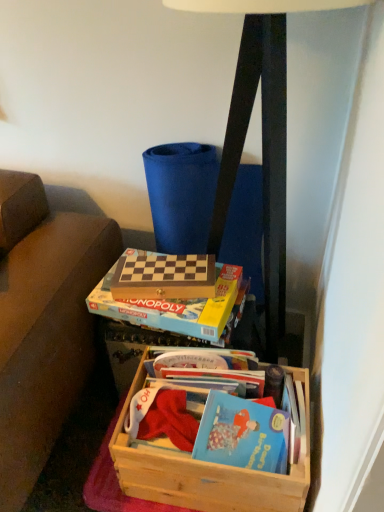
Question: Could you tell me if hardcover book at center, which is counted as the 1th paperback book, starting from the front, is facing wooden board game at center, the 1th paperback book in the back-to-front sequence?

Choices:
 (A) yes
 (B) no

Answer: (B)

Question: Considering the relative sizes of hardcover book at center, which is counted as the 1th paperback book, starting from the front, and wooden board game at center, arranged as the second paperback book when viewed from the front, in the image provided, is hardcover book at center, which is counted as the 1th paperback book, starting from the front, shorter than wooden board game at center, arranged as the second paperback book when viewed from the front,?

Choices:
 (A) no
 (B) yes

Answer: (A)

Question: Is hardcover book at center, which is the 2th paperback book from back to front, positioned in front of wooden board game at center, arranged as the second paperback book when viewed from the front?

Choices:
 (A) no
 (B) yes

Answer: (B)

Question: Is there a large distance between hardcover book at center, which is the 2th paperback book from back to front, and wooden board game at center, arranged as the second paperback book when viewed from the front?

Choices:
 (A) yes
 (B) no

Answer: (B)

Question: Considering the relative sizes of hardcover book at center, which is counted as the 1th paperback book, starting from the front, and wooden board game at center, the 1th paperback book in the back-to-front sequence, in the image provided, is hardcover book at center, which is counted as the 1th paperback book, starting from the front, smaller than wooden board game at center, the 1th paperback book in the back-to-front sequence,?

Choices:
 (A) no
 (B) yes

Answer: (A)

Question: From the image's perspective, does hardcover book at center, which is counted as the 1th paperback book, starting from the front, appear lower than wooden board game at center, arranged as the second paperback book when viewed from the front?

Choices:
 (A) yes
 (B) no

Answer: (A)

Question: Would you consider matte black lamp at upper center to be distant from wooden board game at center, arranged as the second paperback book when viewed from the front?

Choices:
 (A) no
 (B) yes

Answer: (A)

Question: From a real-world perspective, is matte black lamp at upper center positioned over wooden board game at center, the 1th paperback book in the back-to-front sequence, based on gravity?

Choices:
 (A) yes
 (B) no

Answer: (A)

Question: Does matte black lamp at upper center have a smaller size compared to wooden board game at center, the 1th paperback book in the back-to-front sequence?

Choices:
 (A) yes
 (B) no

Answer: (B)

Question: Can you confirm if matte black lamp at upper center is shorter than wooden board game at center, arranged as the second paperback book when viewed from the front?

Choices:
 (A) yes
 (B) no

Answer: (B)

Question: Is the position of matte black lamp at upper center more distant than that of wooden board game at center, the 1th paperback book in the back-to-front sequence?

Choices:
 (A) no
 (B) yes

Answer: (A)

Question: Is matte black lamp at upper center completely or partially outside of wooden board game at center, arranged as the second paperback book when viewed from the front?

Choices:
 (A) no
 (B) yes

Answer: (B)

Question: Is hardcover book at center, which is the 2th paperback book from back to front, at the right side of wooden crate at lower center?

Choices:
 (A) no
 (B) yes

Answer: (A)